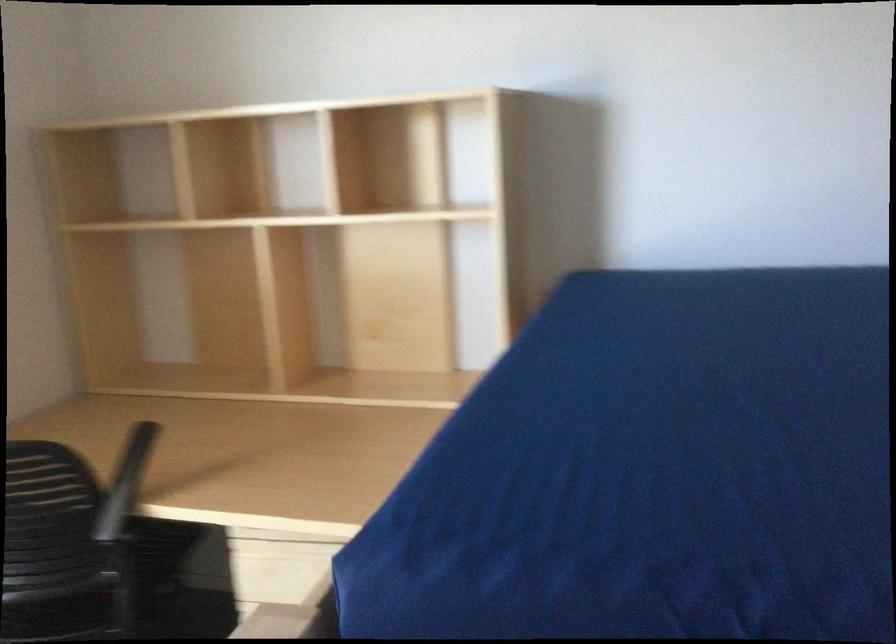
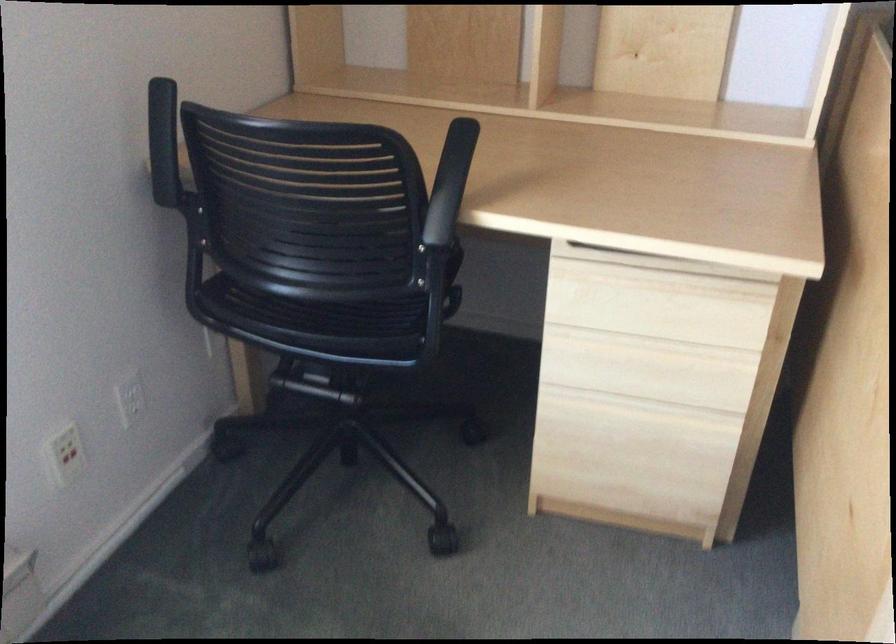
The point at (124, 480) is marked in the first image. Where is the corresponding point in the second image?

(450, 183)